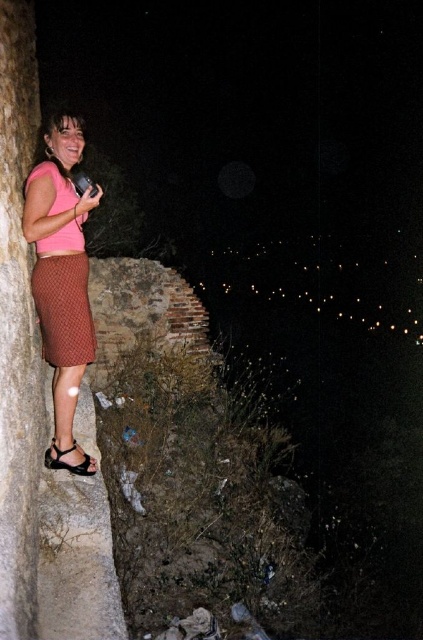
You are a photographer trying to capture the night scene. You notice the brown textured dress at left and the black leather sandal at lower left. Which object is closer to the left edge of the frame?

The brown textured dress at left is positioned on the left side of the black leather sandal at lower left, meaning the dress is closer to the left edge of the frame.

You are a photographer trying to capture the night scene. You notice the pink fabric skirt at left and the black leather sandal at lower left in your frame. Which object will appear larger in your photo?

The pink fabric skirt at left will appear larger in the photo because it is much taller than the black leather sandal at lower left.